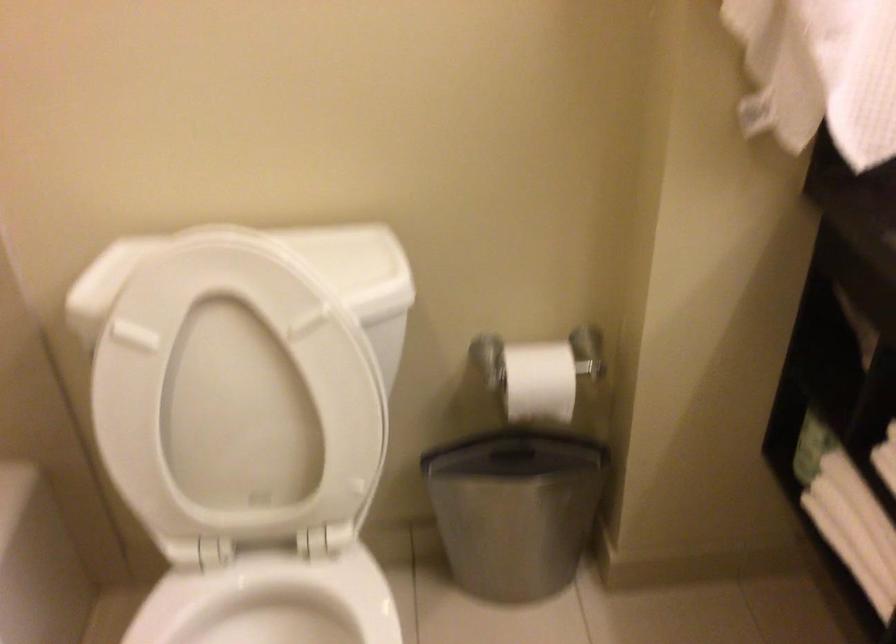
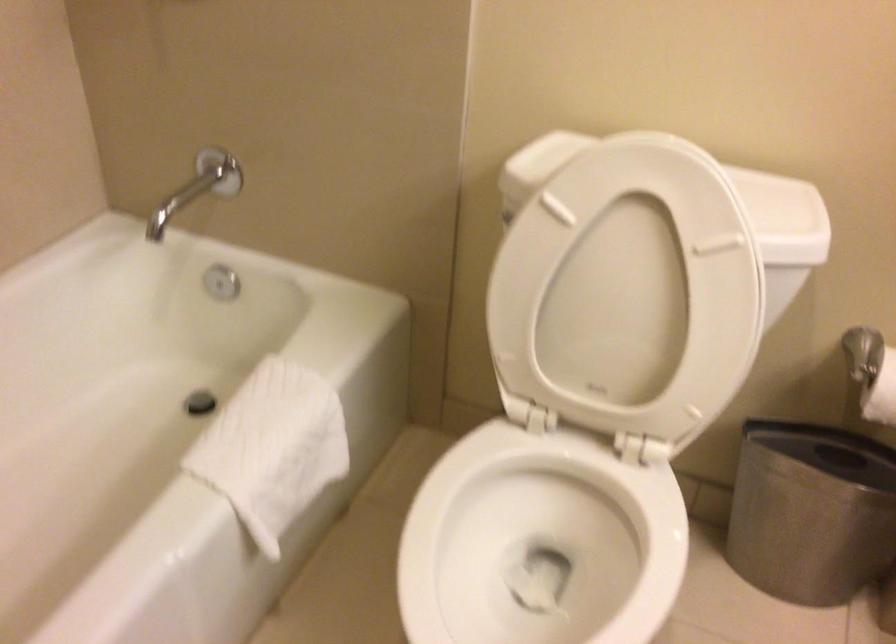
Locate, in the second image, the point that corresponds to (252,388) in the first image.

(633, 285)